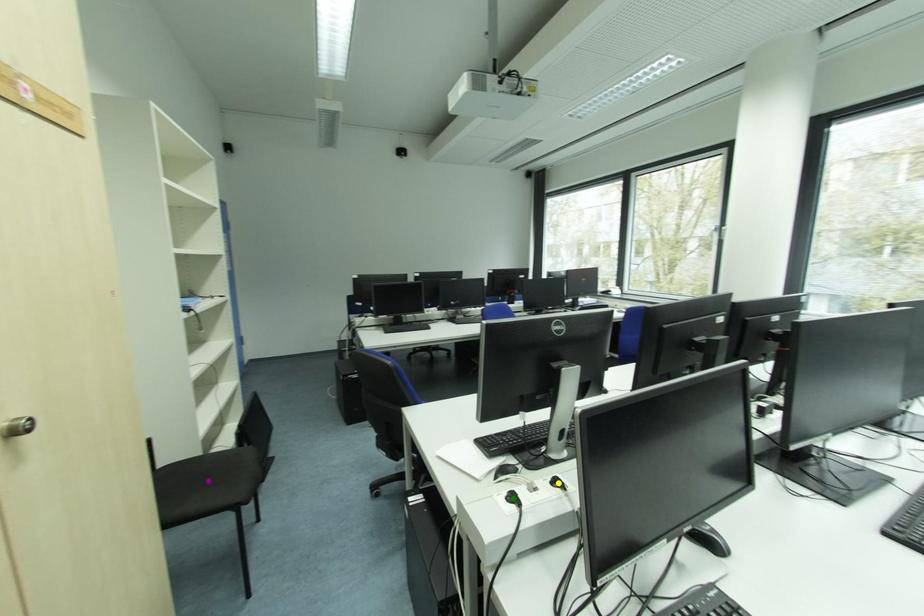
Order these from nearest to farthest:
1. purple point
2. green point
3. yellow point

green point < yellow point < purple point